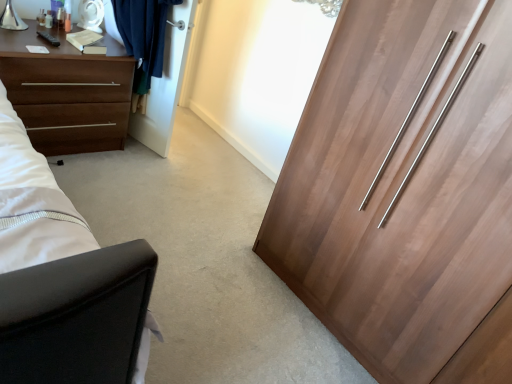
What is the approximate height of brown matte chest of drawers at left?

The height of brown matte chest of drawers at left is 24.28 inches.

Where is `brown matte chest of drawers at left`? The width and height of the screenshot is (512, 384). brown matte chest of drawers at left is located at coordinates (66, 93).

Is wooden wardrobe at right touching brown matte chest of drawers at left?

No, wooden wardrobe at right is not with brown matte chest of drawers at left.

In the scene shown: Is the depth of wooden wardrobe at right less than that of brown matte chest of drawers at left?

Yes, the depth of wooden wardrobe at right is less than that of brown matte chest of drawers at left.

Which is behind, point (392, 232) or point (70, 79)?

The point (70, 79) is farther.

From a real-world perspective, is wooden wardrobe at right physically located above or below brown matte chest of drawers at left?

Clearly, from a real-world perspective, wooden wardrobe at right is above brown matte chest of drawers at left.

Considering the sizes of objects brown matte chest of drawers at left and wooden wardrobe at right in the image provided, who is smaller, brown matte chest of drawers at left or wooden wardrobe at right?

brown matte chest of drawers at left.

Is brown matte chest of drawers at left taller than wooden wardrobe at right?

In fact, brown matte chest of drawers at left may be shorter than wooden wardrobe at right.

What's the angular difference between brown matte chest of drawers at left and wooden wardrobe at right's facing directions?

The angle between the facing direction of brown matte chest of drawers at left and the facing direction of wooden wardrobe at right is 89.6 degrees.

Which is nearer, (189, 32) or (360, 243)?

Positioned in front is point (360, 243).

Could you tell me if white glossy door at upper center is turned towards wooden wardrobe at right?

No.

Considering the relative positions of white glossy door at upper center and wooden wardrobe at right in the image provided, is white glossy door at upper center to the left of wooden wardrobe at right from the viewer's perspective?

Yes, white glossy door at upper center is to the left of wooden wardrobe at right.

From the image's perspective, who appears lower, white glossy door at upper center or brown matte chest of drawers at left?

From the image's view, brown matte chest of drawers at left is below.

Can you confirm if white glossy door at upper center is bigger than brown matte chest of drawers at left?

Incorrect, white glossy door at upper center is not larger than brown matte chest of drawers at left.

Is white glossy door at upper center situated inside brown matte chest of drawers at left or outside?

white glossy door at upper center exists outside the volume of brown matte chest of drawers at left.

Does white glossy door at upper center have a greater width compared to brown matte chest of drawers at left?

In fact, white glossy door at upper center might be narrower than brown matte chest of drawers at left.

From the image's perspective, which one is positioned higher, brown matte chest of drawers at left or white glossy door at upper center?

From the image's view, white glossy door at upper center is above.

Is brown matte chest of drawers at left next to white glossy door at upper center and touching it?

No, brown matte chest of drawers at left is not making contact with white glossy door at upper center.

In the scene shown: Could you tell me if brown matte chest of drawers at left is turned towards white glossy door at upper center?

No, brown matte chest of drawers at left is not turned towards white glossy door at upper center.

Is wooden wardrobe at right not close to white glossy door at upper center?

Yes, wooden wardrobe at right and white glossy door at upper center are located far from each other.

Measure the distance between wooden wardrobe at right and white glossy door at upper center.

A distance of 1.39 meters exists between wooden wardrobe at right and white glossy door at upper center.

Is wooden wardrobe at right outside of white glossy door at upper center?

Yes.

In the scene shown: From the image's perspective, which one is positioned higher, wooden wardrobe at right or white glossy door at upper center?

white glossy door at upper center, from the image's perspective.

The height and width of the screenshot is (384, 512). What are the coordinates of `cupboard above the brown matte chest of drawers at left (from a real-world perspective)` in the screenshot? It's located at [x=401, y=183].

I want to click on cupboard to the right of brown matte chest of drawers at left, so click(401, 183).

Looking at the image, which one is located further to white glossy door at upper center, brown matte chest of drawers at left or wooden wardrobe at right?

wooden wardrobe at right is further to white glossy door at upper center.

Based on the photo, looking at the image, which one is located further to brown matte chest of drawers at left, wooden wardrobe at right or white glossy door at upper center?

wooden wardrobe at right.

In the scene shown: Estimate the real-world distances between objects in this image. Which object is further from wooden wardrobe at right, white glossy door at upper center or brown matte chest of drawers at left?

The object further to wooden wardrobe at right is brown matte chest of drawers at left.

Based on their spatial positions, is white glossy door at upper center or wooden wardrobe at right closer to brown matte chest of drawers at left?

Based on the image, white glossy door at upper center appears to be nearer to brown matte chest of drawers at left.

When comparing their distances from wooden wardrobe at right, does brown matte chest of drawers at left or white glossy door at upper center seem further?

The object further to wooden wardrobe at right is brown matte chest of drawers at left.

From the image, which object appears to be nearer to white glossy door at upper center, wooden wardrobe at right or brown matte chest of drawers at left?

Based on the image, brown matte chest of drawers at left appears to be nearer to white glossy door at upper center.

I want to click on door located between brown matte chest of drawers at left and wooden wardrobe at right in the left-right direction, so pos(166,83).